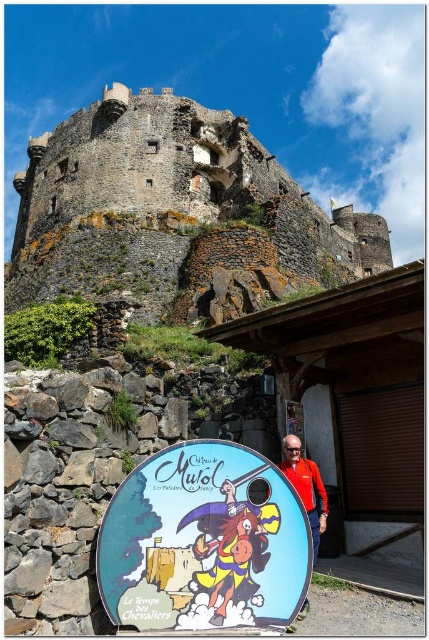
Can you confirm if rusty stone castle at upper center is positioned to the left of matte plastic shield at center?

In fact, rusty stone castle at upper center is to the right of matte plastic shield at center.

Who is taller, rusty stone castle at upper center or matte plastic shield at center?

rusty stone castle at upper center

Does point (111, 189) lie behind point (189, 502)?

Yes, it is behind point (189, 502).

This screenshot has height=640, width=429. What are the coordinates of `rusty stone castle at upper center` in the screenshot? It's located at (175, 216).

At what (x,y) coordinates should I click in order to perform the action: click on rusty stone castle at upper center. Please return your answer as a coordinate pair (x, y). Looking at the image, I should click on (175, 216).

Is rusty stone castle at upper center below orange fabric jacket at center?

No.

This screenshot has height=640, width=429. In order to click on rusty stone castle at upper center in this screenshot , I will do `click(175, 216)`.

This screenshot has height=640, width=429. What are the coordinates of `rusty stone castle at upper center` in the screenshot? It's located at (175, 216).

Is point (183, 444) farther from camera compared to point (311, 502)?

No.

Image resolution: width=429 pixels, height=640 pixels. What are the coordinates of `matte plastic shield at center` in the screenshot? It's located at (204, 541).